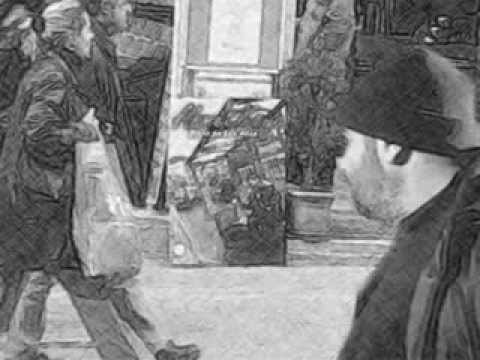
Find the location of `painting in the wall`. painting in the wall is located at coordinates (253, 171).